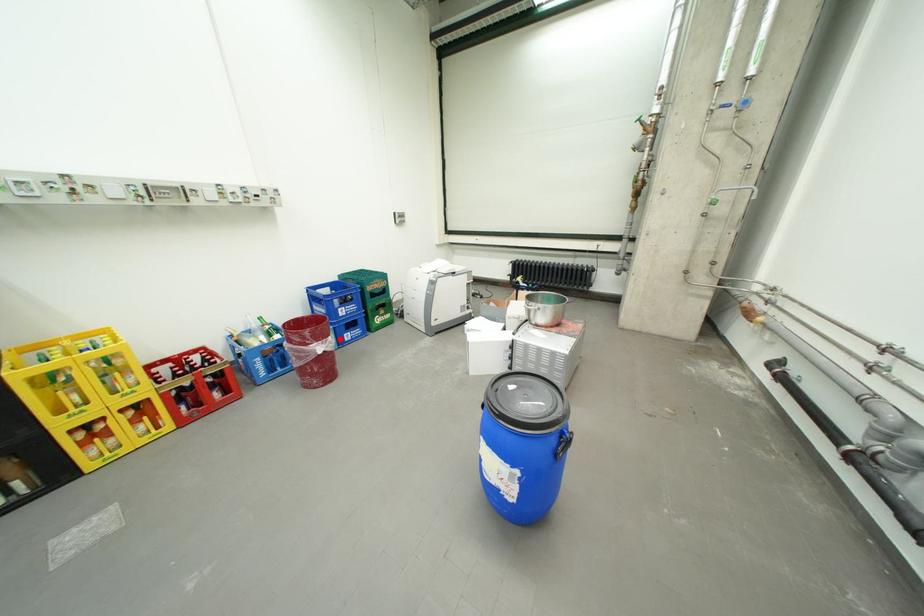
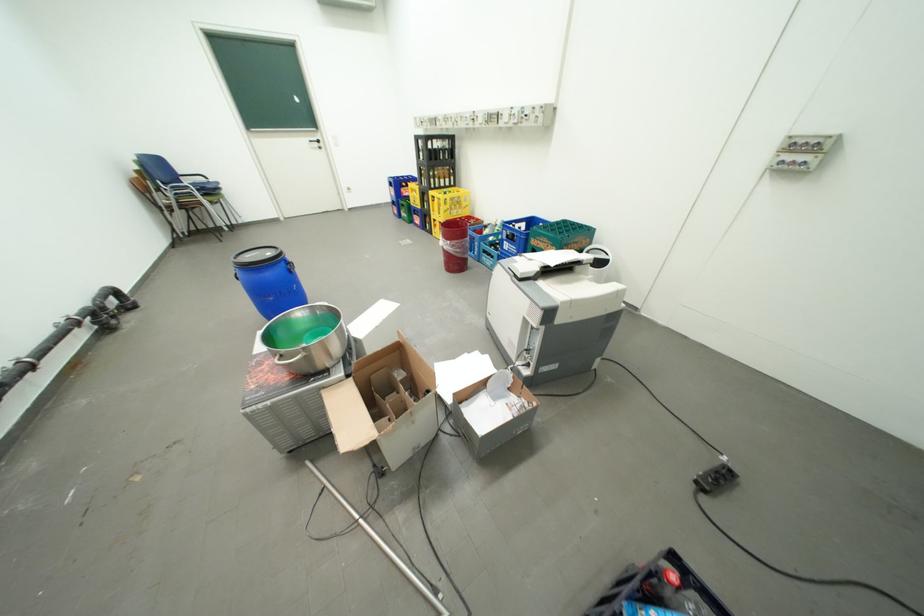
Question: I am providing you with two images of the same scene from different viewpoints. In image1, a red point is highlighted. Considering the same 3D point in image2, which of the following is correct?

Choices:
 (A) It is closer
 (B) It is farther

Answer: (B)